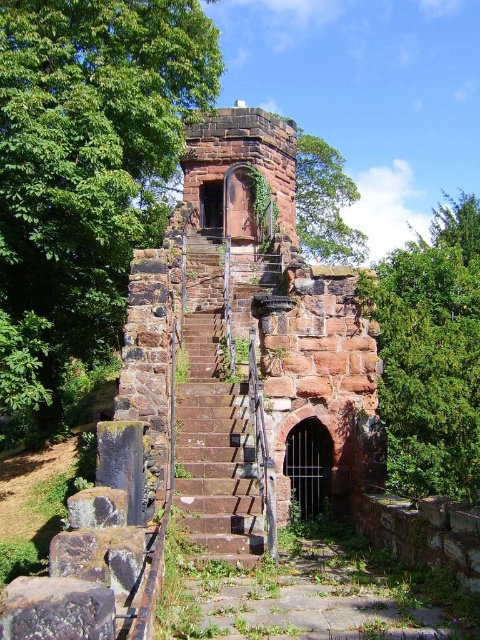
Which is in front, point (230, 116) or point (197, 397)?

Positioned in front is point (197, 397).

Can you confirm if reddish-brown stone stairs at center is taller than brown stone stairs at center?

Correct, reddish-brown stone stairs at center is much taller as brown stone stairs at center.

The image size is (480, 640). Identify the location of reddish-brown stone stairs at center. (250, 304).

Consider the image. Who is positioned more to the right, green leafy tree at upper left or reddish-brown stone stairs at center?

reddish-brown stone stairs at center is more to the right.

Can you confirm if green leafy tree at upper left is positioned above reddish-brown stone stairs at center?

Indeed, green leafy tree at upper left is positioned over reddish-brown stone stairs at center.

Locate an element on the screen. The height and width of the screenshot is (640, 480). green leafy tree at upper left is located at coordinates (84, 170).

The height and width of the screenshot is (640, 480). I want to click on green leafy tree at upper left, so click(x=84, y=170).

Which is more to the left, green leafy tree at upper left or green leafy tree at upper center?

green leafy tree at upper left is more to the left.

Image resolution: width=480 pixels, height=640 pixels. I want to click on green leafy tree at upper left, so click(x=84, y=170).